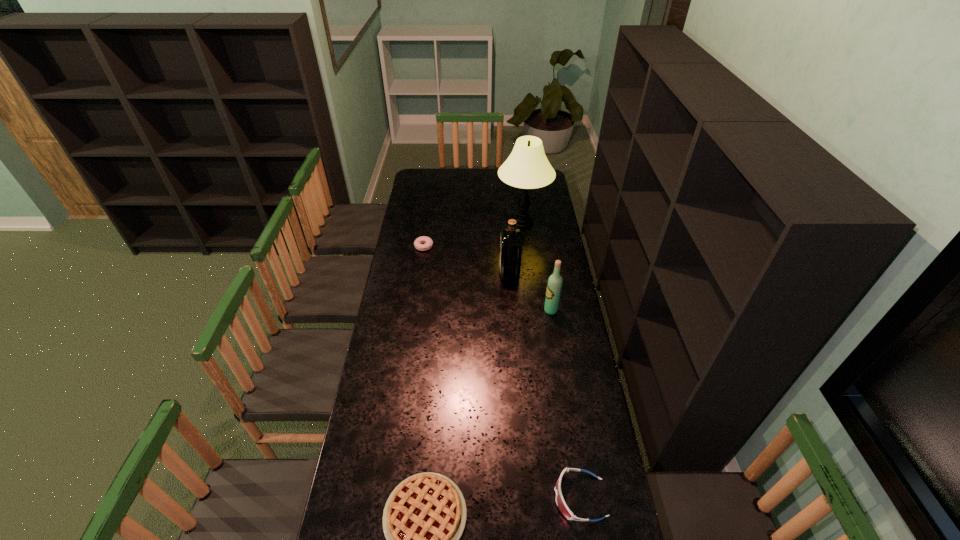
Where is `the farthest object`? the farthest object is located at coordinates (527, 167).

Where is `the tallest object`? the tallest object is located at coordinates (527, 167).

I want to click on liquor, so click(x=511, y=240).

The height and width of the screenshot is (540, 960). In order to click on the fourth farthest object in this screenshot , I will do `click(554, 285)`.

Locate an element on the screen. goggles is located at coordinates [x=561, y=504].

At what (x,y) coordinates should I click in order to perform the action: click on the fifth nearest object. Please return your answer as a coordinate pair (x, y). Looking at the image, I should click on (428, 241).

You are a GUI agent. You are given a task and a screenshot of the screen. Output one action in this format:
    pyautogui.click(x=<x>, y=<y>)
    Task: Click on the doughnut
    
    Given the screenshot: What is the action you would take?
    pyautogui.click(x=428, y=241)

This screenshot has width=960, height=540. Find the location of `vacant space located on the left of the lamp`. vacant space located on the left of the lamp is located at coordinates (429, 224).

Identify the location of vacant space situated 0.300m on the front label of the liquor. The image size is (960, 540). (438, 273).

Identify the location of free spot located 0.060m on the front label of the liquor. The image size is (960, 540). (488, 273).